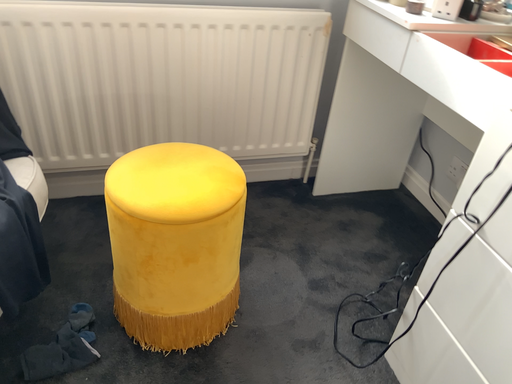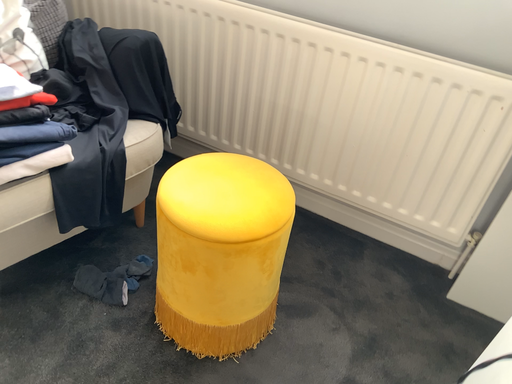
Question: Which way did the camera rotate in the video?

Choices:
 (A) rotated right
 (B) rotated left

Answer: (B)